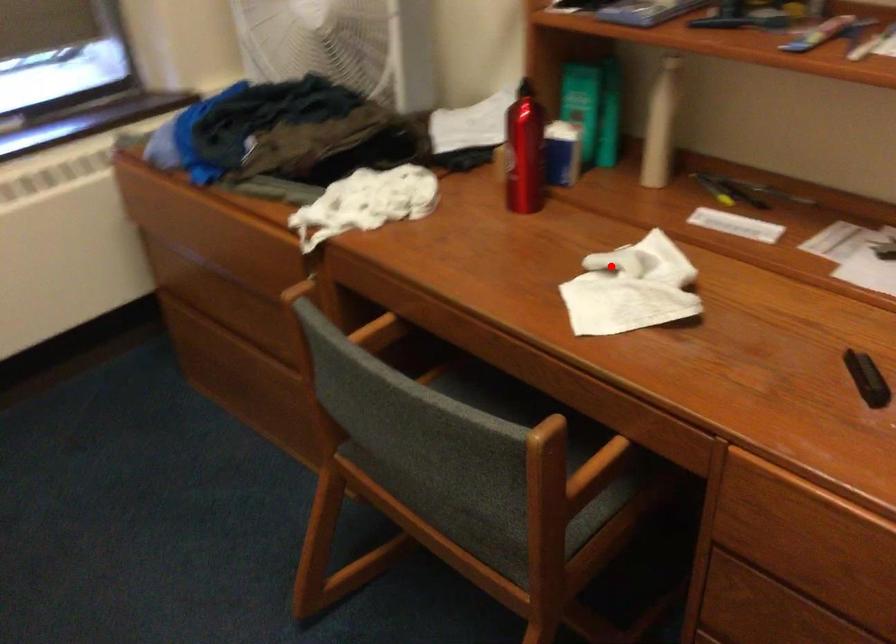
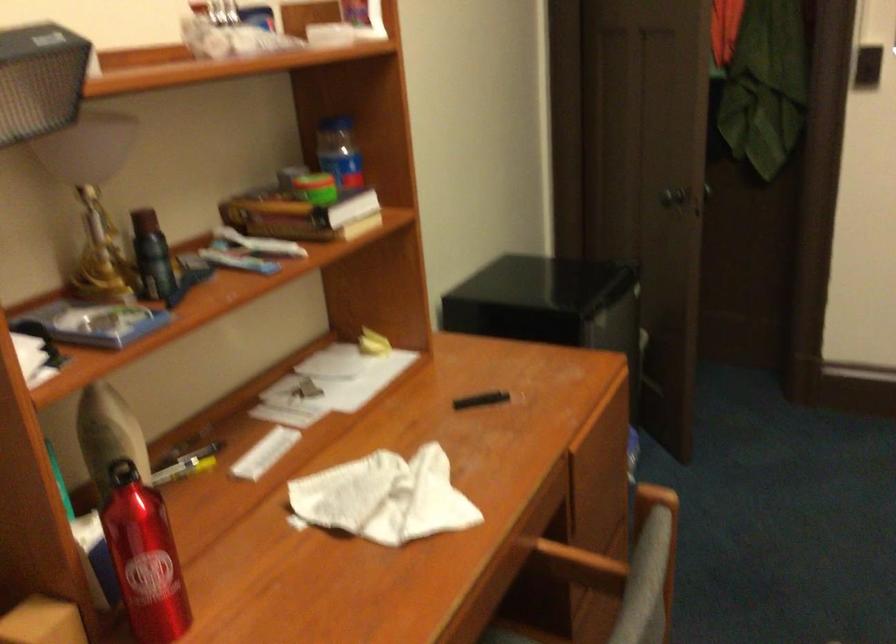
Where in the second image is the point corresponding to the highlighted location from the first image?

(383, 498)